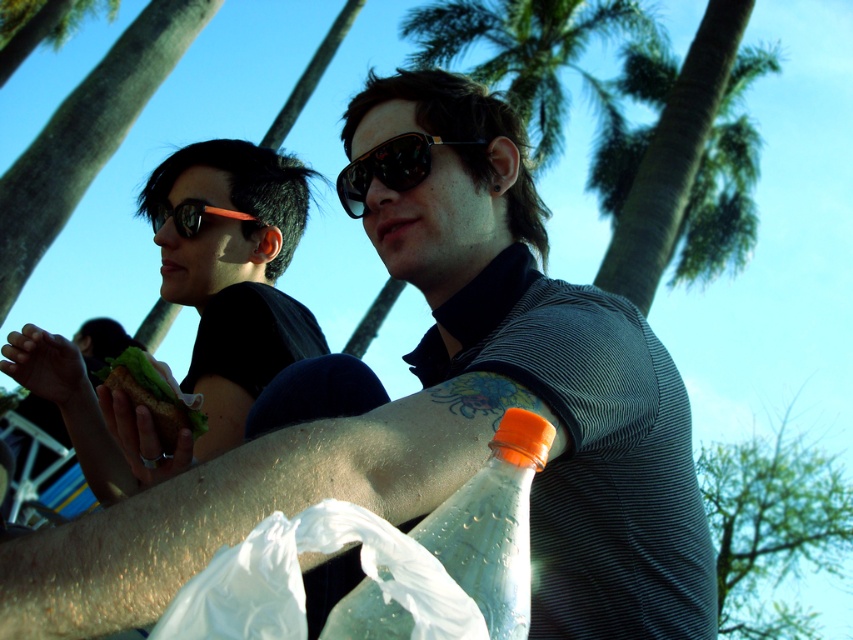
You are standing in a sunny park with a translucent plastic bottle at arm and a green leafy palm tree at upper center. Which object is closer to you?

The translucent plastic bottle at arm is closer to you than the green leafy palm tree at upper center because the description states that the bottle is less than the palm tree in distance.

You are a photographer trying to capture the matte black sunglasses at upper left in the image. Based on their position at point coordinates of [199,314], where should you focus your camera to ensure they are in the frame?

The point coordinates [199,314] indicate the location of the matte black sunglasses at upper left, so you should focus your camera on that specific coordinate to capture them in the frame.